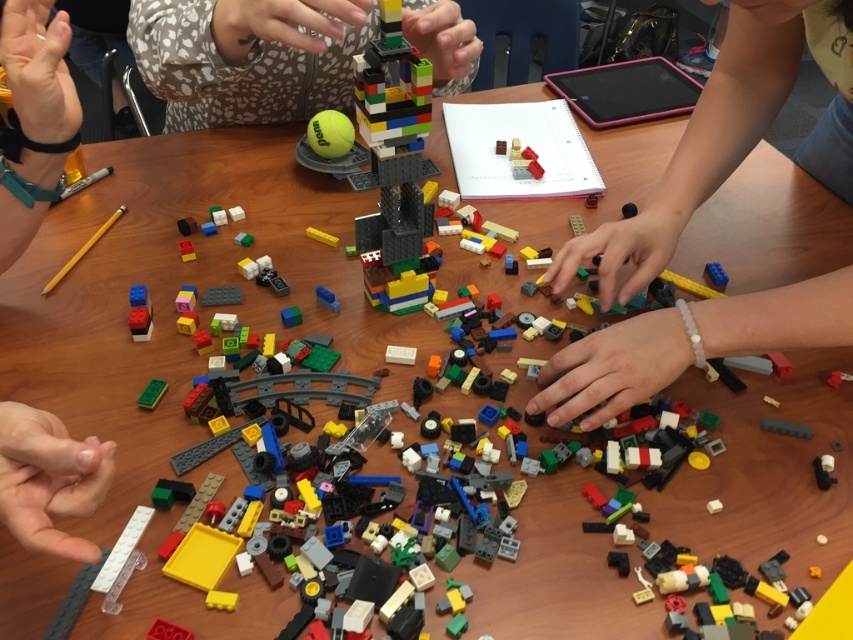
Question: Can you confirm if white matte bracelet at lower center is positioned to the left of matte black hand at lower left?

Choices:
 (A) no
 (B) yes

Answer: (A)

Question: Which object appears farthest from the camera in this image?

Choices:
 (A) smooth plastic hand at lower left
 (B) white matte bracelet at lower center
 (C) green rubber tennis ball at center

Answer: (C)

Question: Which point is farther from the camera taking this photo?

Choices:
 (A) click(328, 124)
 (B) click(26, 113)
 (C) click(3, 467)
 (D) click(148, 68)

Answer: (A)

Question: Is matte black hand at lower left positioned before green matte brick at center?

Choices:
 (A) yes
 (B) no

Answer: (A)

Question: Which point is farther from the camera taking this photo?

Choices:
 (A) (334, 148)
 (B) (440, 10)
 (C) (93, 554)
 (D) (53, 483)

Answer: (A)

Question: Does multicolored plastic lego tower at center have a greater width compared to green matte brick at center?

Choices:
 (A) yes
 (B) no

Answer: (A)